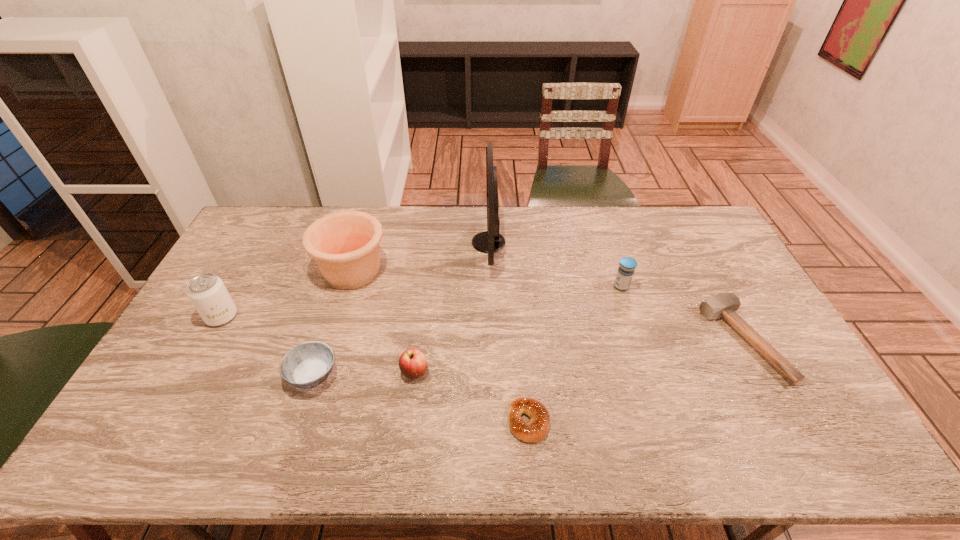
In order to click on free space located 0.050m on the left of the rightmost object in this screenshot , I will do `click(695, 341)`.

Locate an element on the screen. free space located 0.240m on the right of the bagel is located at coordinates (645, 421).

Where is `object at the far edge`? This screenshot has height=540, width=960. object at the far edge is located at coordinates (490, 241).

Identify the location of object located at the near edge. This screenshot has width=960, height=540. (534, 431).

Where is `object that is at the left edge`? object that is at the left edge is located at coordinates (207, 292).

Where is `object located in the right edge section of the desktop`? The height and width of the screenshot is (540, 960). object located in the right edge section of the desktop is located at coordinates (723, 305).

In the image, there is a desktop. Where is `blank space at the far edge`? The height and width of the screenshot is (540, 960). blank space at the far edge is located at coordinates (590, 242).

The image size is (960, 540). Identify the location of vacant space at the near edge. (444, 452).

Where is `vacant space at the right edge of the desktop`? The image size is (960, 540). vacant space at the right edge of the desktop is located at coordinates (704, 273).

At what (x,y) coordinates should I click in order to perform the action: click on blank space at the far right corner. Please return your answer as a coordinate pair (x, y). The width and height of the screenshot is (960, 540). Looking at the image, I should click on (682, 209).